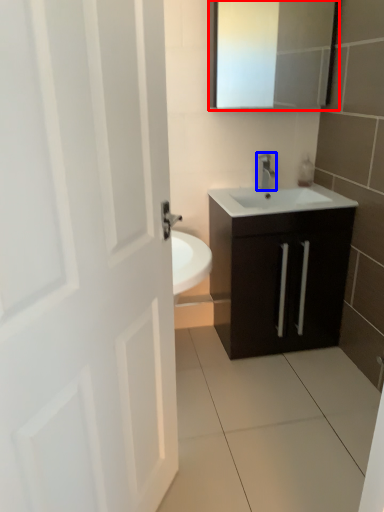
Question: Which of the following is the closest to the observer, medicine cabinet (highlighted by a red box) or tap (highlighted by a blue box)?

Choices:
 (A) medicine cabinet
 (B) tap

Answer: (A)